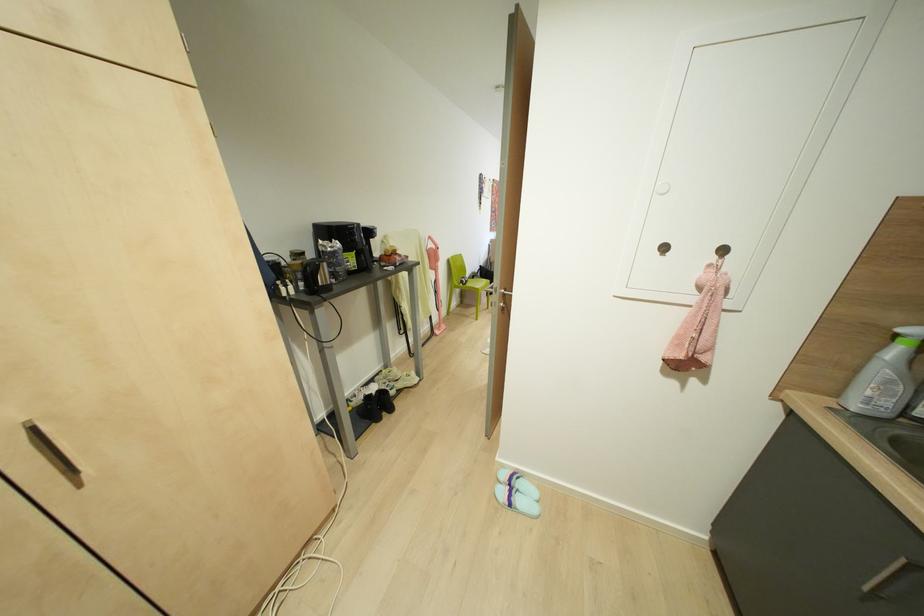
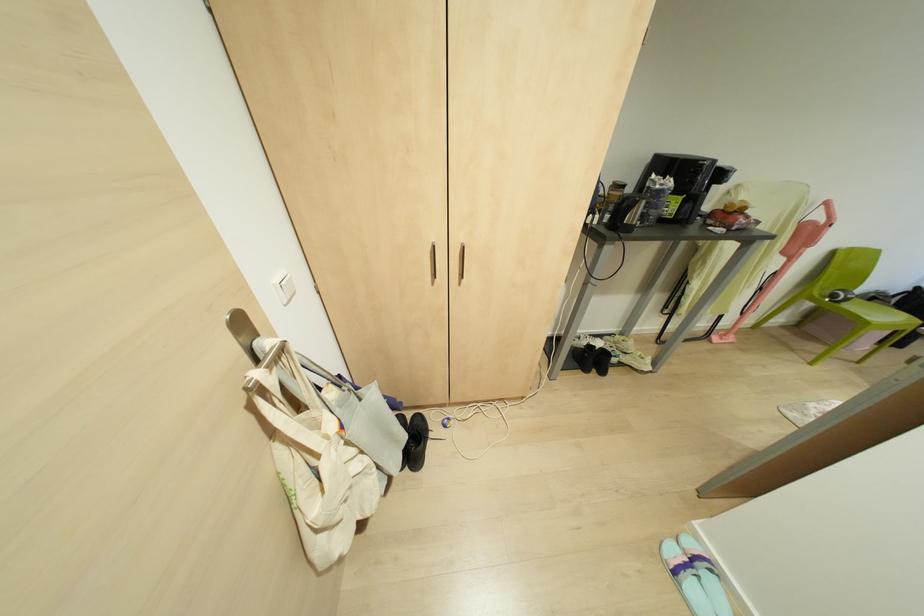
In the second image, find the point that corresponds to the point at 79,485 in the first image.

(458, 284)